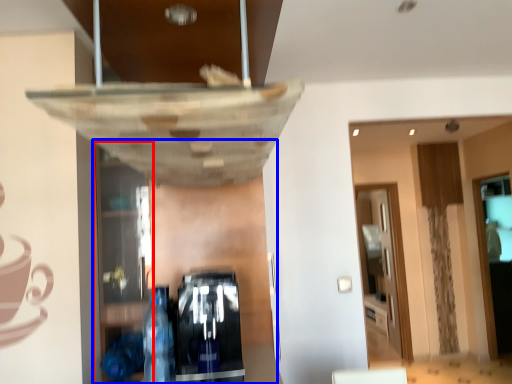
Question: Among these objects, which one is nearest to the camera, shelf (highlighted by a red box) or shelf (highlighted by a blue box)?

Choices:
 (A) shelf
 (B) shelf

Answer: (A)